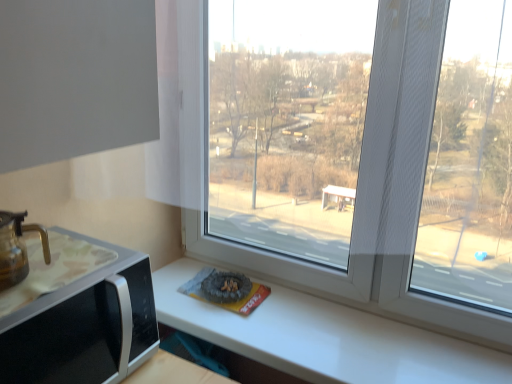
Describe the element at coordinates (78, 314) in the screenshot. I see `black plastic microwave at lower left` at that location.

At what (x,y) coordinates should I click in order to perform the action: click on black plastic microwave at lower left. Please return your answer as a coordinate pair (x, y). Looking at the image, I should click on (78, 314).

What do you see at coordinates (17, 247) in the screenshot? The image size is (512, 384). I see `translucent glass coffeepot at lower left` at bounding box center [17, 247].

I want to click on translucent glass coffeepot at lower left, so click(x=17, y=247).

Find the location of a particular element. Image resolution: width=512 pixels, height=384 pixels. black plastic microwave at lower left is located at coordinates (78, 314).

Is translucent glass coffeepot at lower left to the left or to the right of black plastic microwave at lower left in the image?

translucent glass coffeepot at lower left is positioned on black plastic microwave at lower left's left side.

Relative to black plastic microwave at lower left, is translucent glass coffeepot at lower left in front or behind?

translucent glass coffeepot at lower left is positioned farther from the viewer than black plastic microwave at lower left.

Is point (22, 231) less distant than point (90, 338)?

Yes, it is.

Looking at this image, from the image's perspective, would you say translucent glass coffeepot at lower left is positioned over black plastic microwave at lower left?

Yes, from the image's perspective, translucent glass coffeepot at lower left is over black plastic microwave at lower left.

From a real-world perspective, which object rests below the other?

black plastic microwave at lower left is physically lower.

Is translucent glass coffeepot at lower left wider or thinner than black plastic microwave at lower left?

Considering their sizes, translucent glass coffeepot at lower left looks slimmer than black plastic microwave at lower left.

From their relative heights in the image, would you say translucent glass coffeepot at lower left is taller or shorter than black plastic microwave at lower left?

In the image, translucent glass coffeepot at lower left appears to be shorter than black plastic microwave at lower left.

Does translucent glass coffeepot at lower left have a smaller size compared to black plastic microwave at lower left?

Indeed, translucent glass coffeepot at lower left has a smaller size compared to black plastic microwave at lower left.

Is translucent glass coffeepot at lower left completely or partially outside of black plastic microwave at lower left?

Yes, translucent glass coffeepot at lower left is outside of black plastic microwave at lower left.

Are translucent glass coffeepot at lower left and black plastic microwave at lower left beside each other?

There is a gap between translucent glass coffeepot at lower left and black plastic microwave at lower left.

Could you tell me if translucent glass coffeepot at lower left is facing black plastic microwave at lower left?

No.

How different are the orientations of translucent glass coffeepot at lower left and black plastic microwave at lower left in degrees?

The facing directions of translucent glass coffeepot at lower left and black plastic microwave at lower left are 0.000283 degrees apart.

Could you measure the distance between translucent glass coffeepot at lower left and black plastic microwave at lower left?

translucent glass coffeepot at lower left is 5.77 inches away from black plastic microwave at lower left.

Identify the location of appliance on the right of translucent glass coffeepot at lower left. (78, 314).

Is black plastic microwave at lower left to the right of translucent glass coffeepot at lower left from the viewer's perspective?

Indeed, black plastic microwave at lower left is positioned on the right side of translucent glass coffeepot at lower left.

Between black plastic microwave at lower left and translucent glass coffeepot at lower left, which one is positioned behind?

translucent glass coffeepot at lower left is behind.

Which is behind, point (28, 328) or point (20, 259)?

The point (20, 259) is farther from the camera.

From the image's perspective, which one is positioned higher, black plastic microwave at lower left or translucent glass coffeepot at lower left?

translucent glass coffeepot at lower left.

From a real-world perspective, between black plastic microwave at lower left and translucent glass coffeepot at lower left, who is vertically lower?

In real-world perspective, black plastic microwave at lower left is lower.

Considering the sizes of objects black plastic microwave at lower left and translucent glass coffeepot at lower left in the image provided, who is thinner, black plastic microwave at lower left or translucent glass coffeepot at lower left?

Thinner between the two is translucent glass coffeepot at lower left.

Considering the relative sizes of black plastic microwave at lower left and translucent glass coffeepot at lower left in the image provided, is black plastic microwave at lower left shorter than translucent glass coffeepot at lower left?

Incorrect, the height of black plastic microwave at lower left does not fall short of that of translucent glass coffeepot at lower left.

Between black plastic microwave at lower left and translucent glass coffeepot at lower left, which one has smaller size?

translucent glass coffeepot at lower left is smaller.

Is translucent glass coffeepot at lower left completely or partially inside black plastic microwave at lower left?

No.

Are black plastic microwave at lower left and translucent glass coffeepot at lower left far apart?

No.

Is black plastic microwave at lower left facing towards translucent glass coffeepot at lower left?

No, black plastic microwave at lower left is not facing towards translucent glass coffeepot at lower left.

Identify the location of coffeepot positioned vertically above the black plastic microwave at lower left (from a real-world perspective). (17, 247).

The width and height of the screenshot is (512, 384). What are the coordinates of `coffeepot positioned vertically above the black plastic microwave at lower left (from a real-world perspective)` in the screenshot? It's located at (17, 247).

This screenshot has width=512, height=384. What are the coordinates of `coffeepot on the left of black plastic microwave at lower left` in the screenshot? It's located at (17, 247).